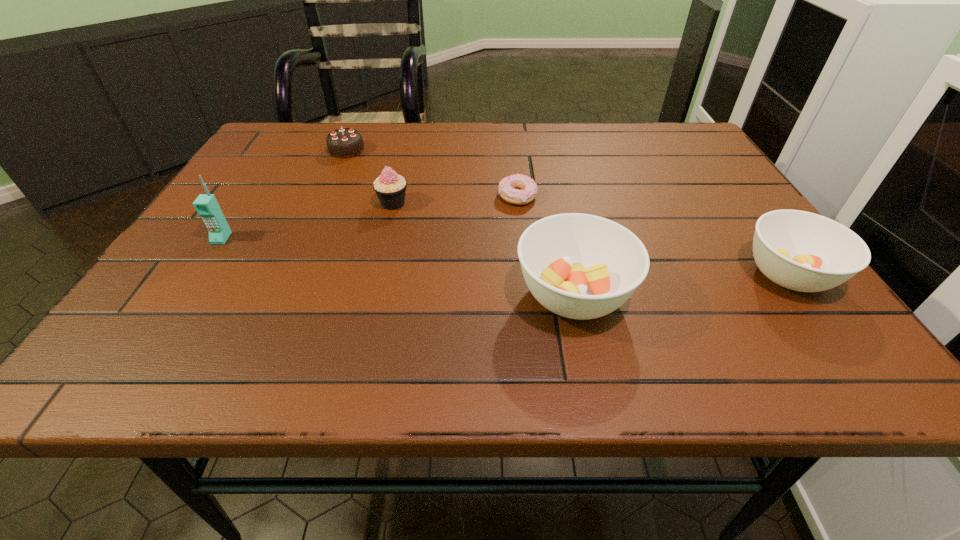
This screenshot has width=960, height=540. In order to click on free space that is in between the right soup bowl and the shortest object in this screenshot , I will do `click(653, 235)`.

Point out which object is positioned as the nearest to the left soup bowl. Please provide its 2D coordinates. Your answer should be formatted as a tuple, i.e. [(x, y)], where the tuple contains the x and y coordinates of a point satisfying the conditions above.

[(508, 188)]

This screenshot has height=540, width=960. What are the coordinates of `object that can be found as the fourth closest to the third object from left to right` in the screenshot? It's located at (206, 205).

In order to click on blank area in the image that satisfies the following two spatial constraints: 1. on the keypad of the tallest object; 2. on the left side of the left soup bowl in this screenshot , I will do `click(184, 295)`.